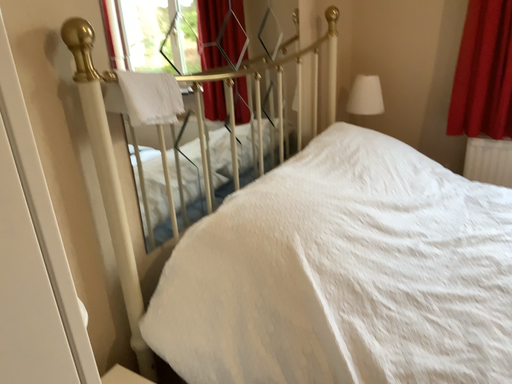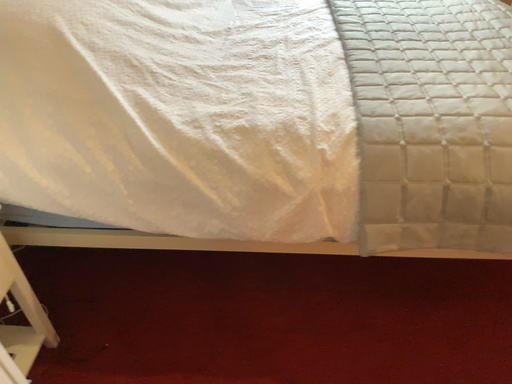
Question: How did the camera likely rotate when shooting the video?

Choices:
 (A) rotated upward
 (B) rotated downward

Answer: (B)